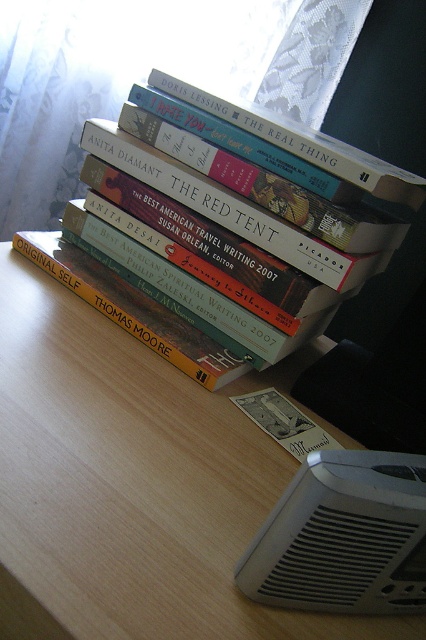
Question: Does wooden table at center have a smaller size compared to yellow matte book at center?

Choices:
 (A) no
 (B) yes

Answer: (A)

Question: Can you confirm if hardcover book at center is positioned below yellow matte book at center?

Choices:
 (A) yes
 (B) no

Answer: (B)

Question: Which object is farther from the camera taking this photo?

Choices:
 (A) hardcover book at center
 (B) yellow matte book at center
 (C) wooden table at center

Answer: (B)

Question: Which point is farther from the camera taking this photo?

Choices:
 (A) (294, 344)
 (B) (40, 234)
 (C) (17, 380)

Answer: (B)

Question: Considering the real-world distances, which object is closest to the hardcover book at center?

Choices:
 (A) wooden table at center
 (B) yellow matte book at center

Answer: (B)

Question: Is wooden table at center closer to the viewer compared to yellow matte book at center?

Choices:
 (A) yes
 (B) no

Answer: (A)